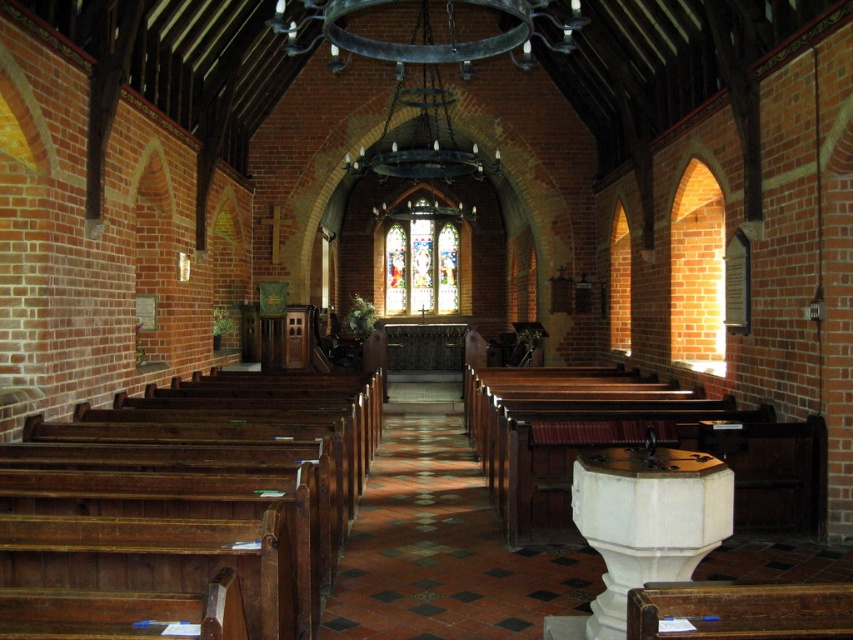
Is dark brown wood pews at left taller than stained glass at center?

No, dark brown wood pews at left is not taller than stained glass at center.

The image size is (853, 640). What are the coordinates of `dark brown wood pews at left` in the screenshot? It's located at (184, 506).